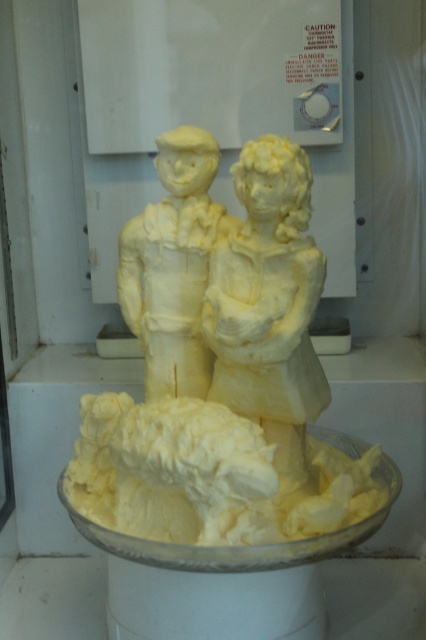
Question: Is white creamy icing at lower center below yellow butter sculpture at center?

Choices:
 (A) no
 (B) yes

Answer: (B)

Question: Which of the following is the farthest from the observer?

Choices:
 (A) buttery yellow sculpture at center
 (B) white creamy icing at lower center

Answer: (A)

Question: Among these points, which one is nearest to the camera?

Choices:
 (A) (178, 339)
 (B) (290, 522)
 (C) (279, 310)

Answer: (C)

Question: Which point is farther to the camera?

Choices:
 (A) (178, 504)
 (B) (140, 321)
 (C) (308, 288)

Answer: (B)

Question: Can you confirm if buttery yellow sculpture at center is wider than yellow butter sculpture at center?

Choices:
 (A) yes
 (B) no

Answer: (B)

Question: Can you confirm if white creamy icing at lower center is positioned to the left of buttery yellow sculpture at center?

Choices:
 (A) yes
 (B) no

Answer: (A)